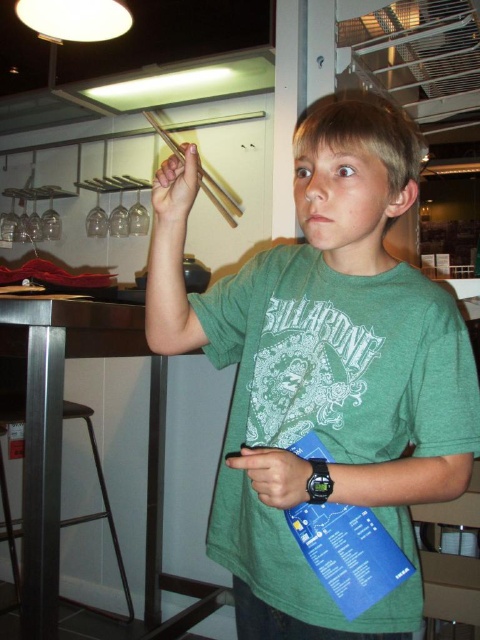
Question: Which of the following is the farthest from the observer?

Choices:
 (A) matte green t-shirt at center
 (B) matte wood chopsticks at upper left

Answer: (B)

Question: Which point appears closest to the camera in this image?

Choices:
 (A) (12, 570)
 (B) (168, 132)
 (C) (180, 344)

Answer: (C)

Question: Does matte wood chopsticks at upper center have a greater width compared to wooden chopsticks at upper center?

Choices:
 (A) no
 (B) yes

Answer: (A)

Question: Considering the relative positions of matte wood chopsticks at upper center and wooden chopsticks at upper center in the image provided, where is matte wood chopsticks at upper center located with respect to wooden chopsticks at upper center?

Choices:
 (A) above
 (B) below

Answer: (B)

Question: Can you confirm if matte wood chopsticks at upper center is smaller than wooden chopsticks at upper center?

Choices:
 (A) no
 (B) yes

Answer: (B)

Question: Which of the following is the farthest from the observer?

Choices:
 (A) matte wood chopsticks at upper left
 (B) wooden chopsticks at upper center

Answer: (B)